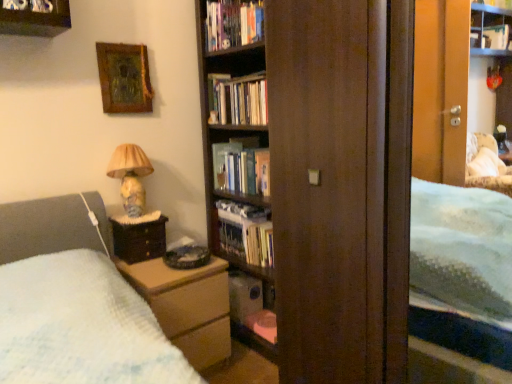
Question: Would you say hardcover book at upper center, the 5th book positioned from the bottom, is inside or outside wooden bookcase at center?

Choices:
 (A) outside
 (B) inside

Answer: (A)

Question: Considering the positions of hardcover book at upper center, acting as the 1th book starting from the top, and wooden bookcase at center in the image, is hardcover book at upper center, acting as the 1th book starting from the top, bigger or smaller than wooden bookcase at center?

Choices:
 (A) big
 (B) small

Answer: (B)

Question: Which is nearer to the hardcover book at center?

Choices:
 (A) matte ceramic lamp at left
 (B) wooden chest of drawers at lower left
 (C) brown wood nightstand at left
 (D) hardcover book at upper center, the 5th book positioned from the bottom
 (E) hardcover book at center, arranged as the 3th book when viewed from the top

Answer: (E)

Question: Considering the real-world distances, which object is farthest from the matte plastic shelf at lower center?

Choices:
 (A) hardcover book at center, arranged as the 3th book when viewed from the top
 (B) wooden framed artwork at upper left
 (C) matte ceramic lamp at left
 (D) wooden chest of drawers at lower left
 (E) wooden bookcase at center

Answer: (B)